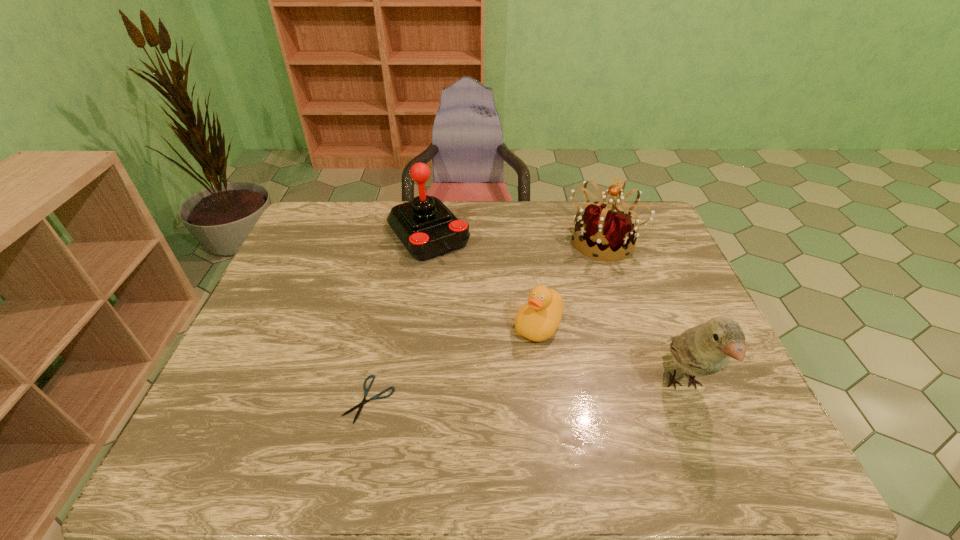
Find the location of a particular element. The height and width of the screenshot is (540, 960). vacant region that satisfies the following two spatial constraints: 1. on the front side of the joystick; 2. on the left side of the tiara is located at coordinates 427,241.